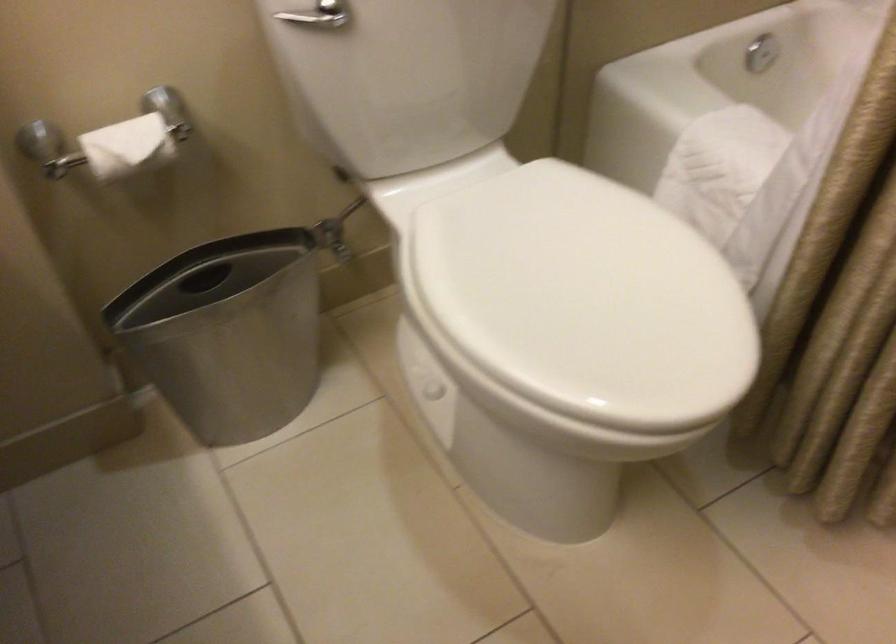
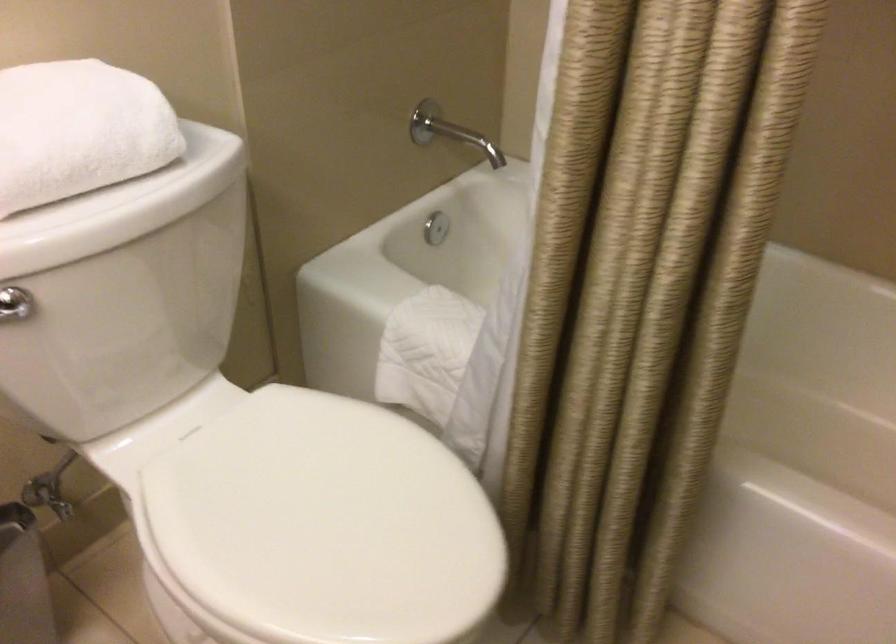
Question: The camera is either moving clockwise (left) or counter-clockwise (right) around the object. The first image is from the beginning of the video and the second image is from the end. Is the camera moving left or right when shooting the video?

Choices:
 (A) Left
 (B) Right

Answer: (A)